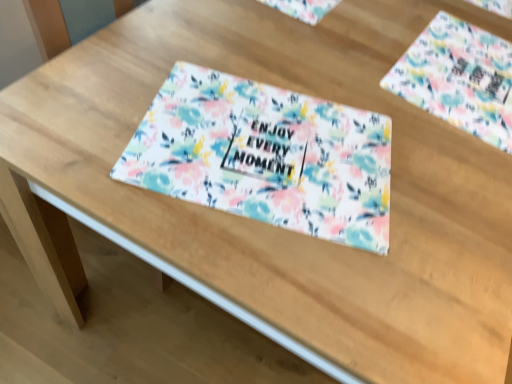
Question: Would you say floral fabric placemat at upper right contains floral fabric placemat at center?

Choices:
 (A) no
 (B) yes

Answer: (A)

Question: Does floral fabric placemat at upper right turn towards floral fabric placemat at center?

Choices:
 (A) no
 (B) yes

Answer: (A)

Question: Would you say floral fabric placemat at upper right is outside floral fabric placemat at center?

Choices:
 (A) yes
 (B) no

Answer: (A)

Question: Does floral fabric placemat at upper right have a greater width compared to floral fabric placemat at center?

Choices:
 (A) yes
 (B) no

Answer: (A)

Question: Is floral fabric placemat at upper right facing away from floral fabric placemat at center?

Choices:
 (A) yes
 (B) no

Answer: (A)

Question: Considering the relative sizes of floral fabric placemat at upper right and floral fabric placemat at center in the image provided, is floral fabric placemat at upper right shorter than floral fabric placemat at center?

Choices:
 (A) yes
 (B) no

Answer: (B)

Question: Can you confirm if floral fabric placemat at center is bigger than floral fabric placemat at upper right?

Choices:
 (A) yes
 (B) no

Answer: (B)

Question: From the image's perspective, is floral fabric placemat at center above floral fabric placemat at upper right?

Choices:
 (A) no
 (B) yes

Answer: (A)

Question: Is floral fabric placemat at center directly adjacent to floral fabric placemat at upper right?

Choices:
 (A) no
 (B) yes

Answer: (A)

Question: Would you say floral fabric placemat at center contains floral fabric placemat at upper right?

Choices:
 (A) yes
 (B) no

Answer: (B)

Question: Is the position of floral fabric placemat at center more distant than that of floral fabric placemat at upper right?

Choices:
 (A) no
 (B) yes

Answer: (A)

Question: From a real-world perspective, is floral fabric placemat at center positioned over floral fabric placemat at upper right based on gravity?

Choices:
 (A) no
 (B) yes

Answer: (B)

Question: In terms of size, does floral fabric placemat at upper right appear bigger or smaller than floral fabric placemat at center?

Choices:
 (A) small
 (B) big

Answer: (B)